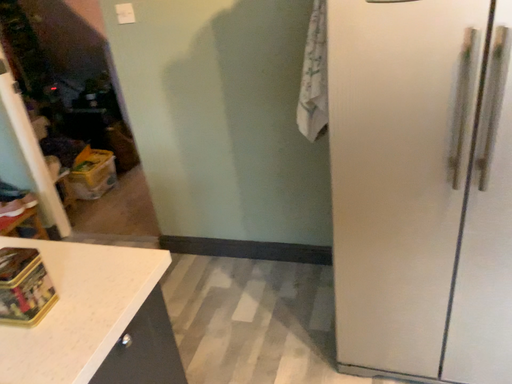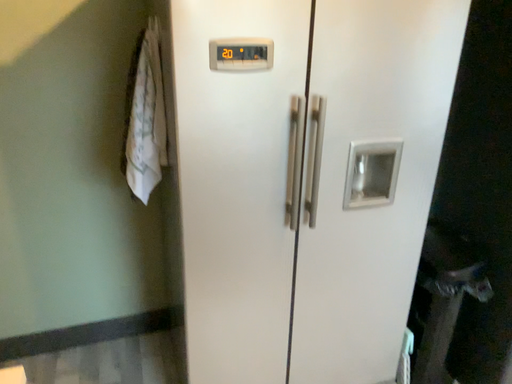
Question: Which way did the camera rotate in the video?

Choices:
 (A) rotated downward
 (B) rotated upward

Answer: (B)